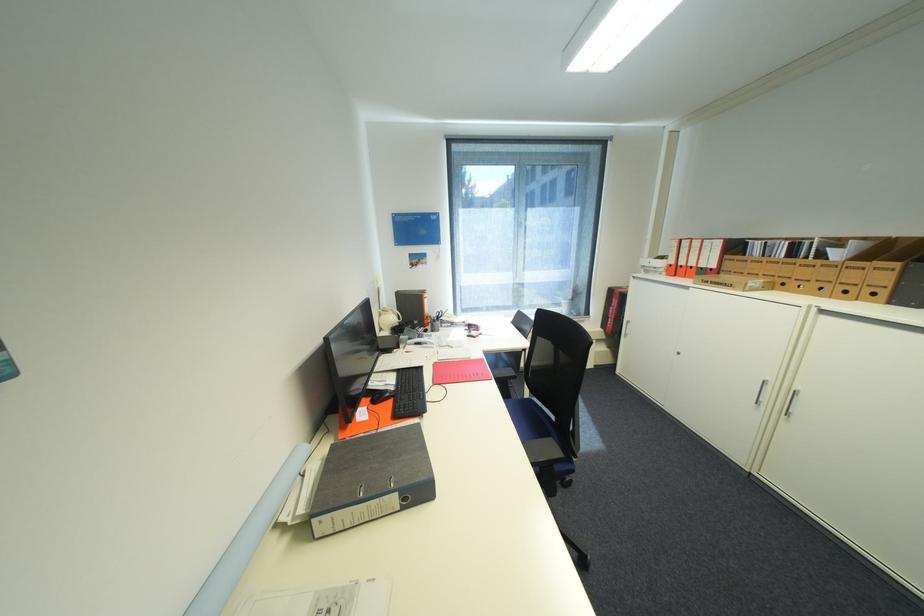
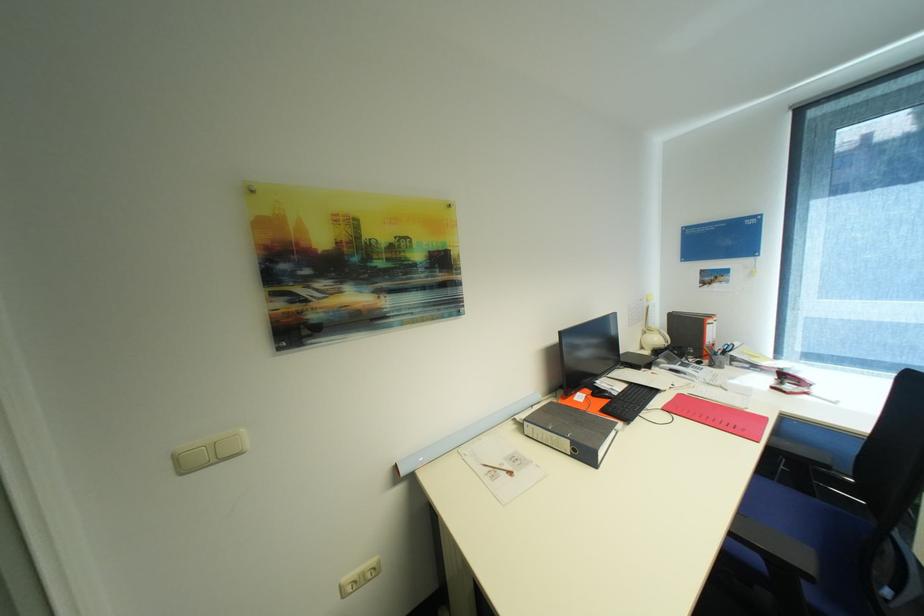
Locate, in the second image, the point that corresponds to point 402,383 in the first image.

(627, 391)